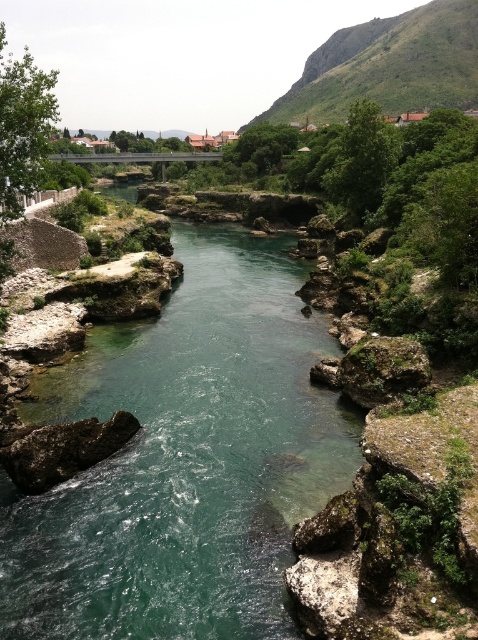
You are a hiker planning to cross the river using the bridge in the background. From the bridge, which direction should you look to see the clear water at center and the green grassy hillside at upper right?

The clear water at center is located below the green grassy hillside at upper right. Therefore, from the bridge, you should look downward to see the clear water at center and upward or to the right to see the green grassy hillside at upper right.

You are standing at the rough brown rock at lower left and want to reach the green grassy hillside at upper right. Which direction should you move to get there?

You should move to the right to reach the green grassy hillside at upper right because it is located to the right of the rough brown rock at lower left.

You are planning to set up a tent for a camping trip. You have two options for the location based on the image provided. The first option is on the green grassy hillside at upper right, and the second is on the rough brown rock at lower left. Considering the size of the available spaces, which location would provide more area for setting up your tent?

The green grassy hillside at upper right is larger in size than the rough brown rock at lower left, so it would provide more area for setting up your tent.